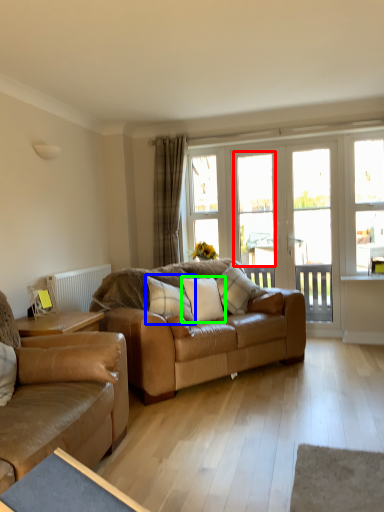
Question: Estimate the real-world distances between objects in this image. Which object is closer to window (highlighted by a red box), pillow (highlighted by a blue box) or pillow (highlighted by a green box)?

Choices:
 (A) pillow
 (B) pillow

Answer: (B)